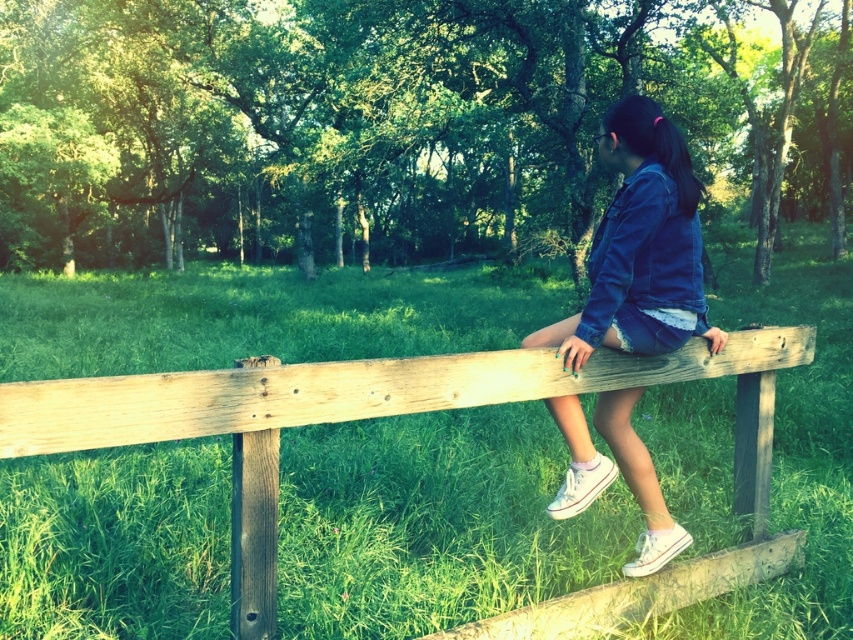
Question: Can you confirm if wooden fence at center is positioned above denim jacket at center?

Choices:
 (A) no
 (B) yes

Answer: (A)

Question: Which object is closer to the camera taking this photo?

Choices:
 (A) wooden fence at center
 (B) denim jacket at center

Answer: (A)

Question: Is wooden fence at center wider than denim jacket at center?

Choices:
 (A) yes
 (B) no

Answer: (A)

Question: Which object appears closest to the camera in this image?

Choices:
 (A) wooden fence at center
 (B) denim jacket at center

Answer: (A)

Question: Is wooden fence at center bigger than denim jacket at center?

Choices:
 (A) no
 (B) yes

Answer: (B)